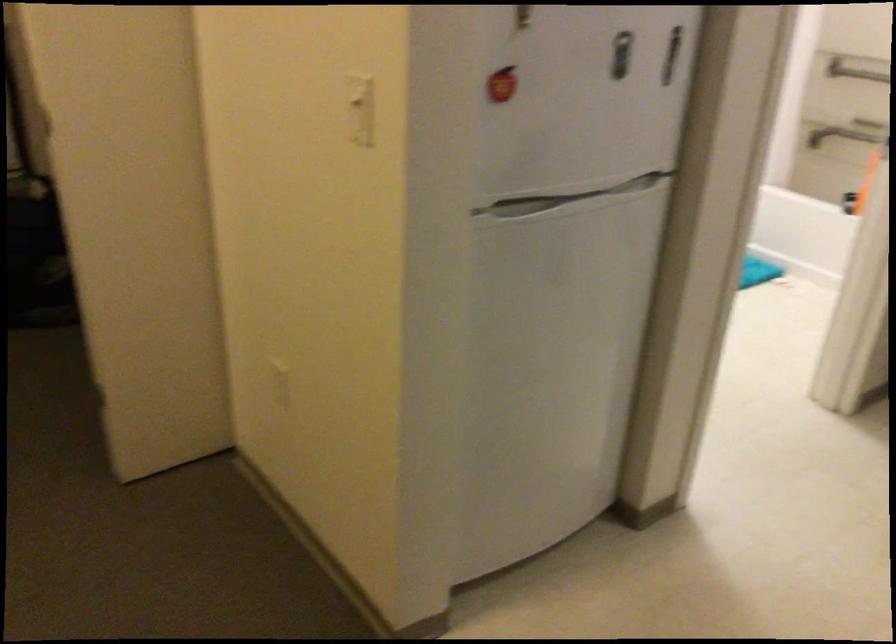
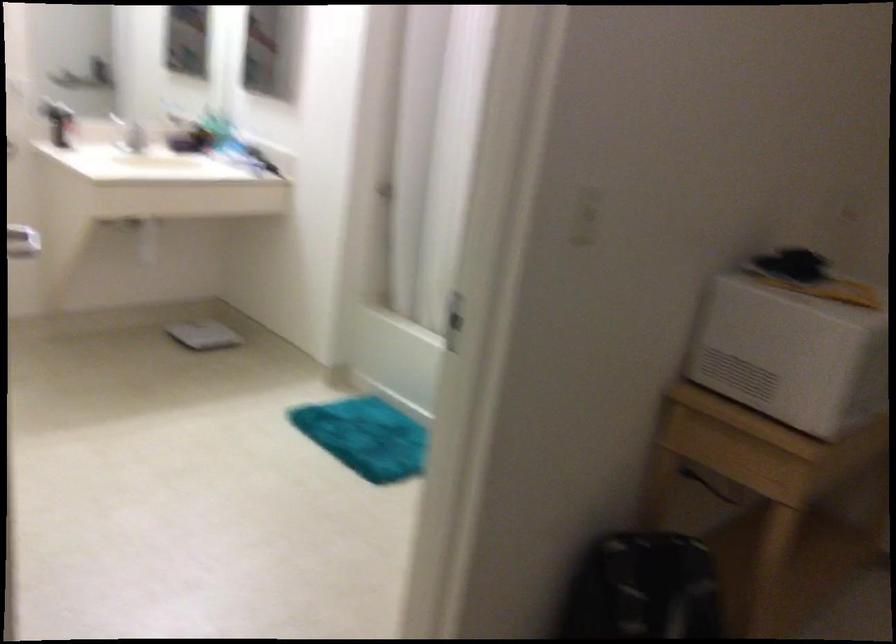
Looking at this image, what movement of the cameraman would produce the second image?

The cameraman moved toward right, forward.